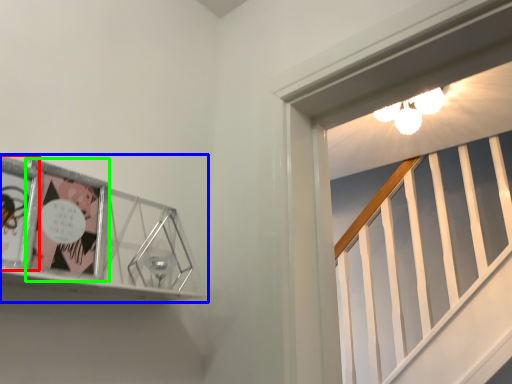
Question: Which is nearer to the comic book (highlighted by a red box)? picture frame (highlighted by a blue box) or comic book (highlighted by a green box).

Choices:
 (A) picture frame
 (B) comic book

Answer: (B)